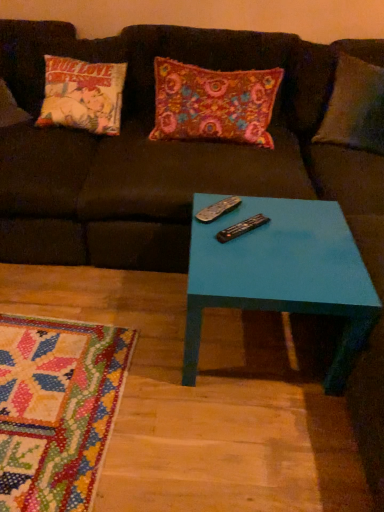
Identify the location of vacant area in front of black plastic remote at center, which is counted as the 2th remote, starting from the front. (225, 251).